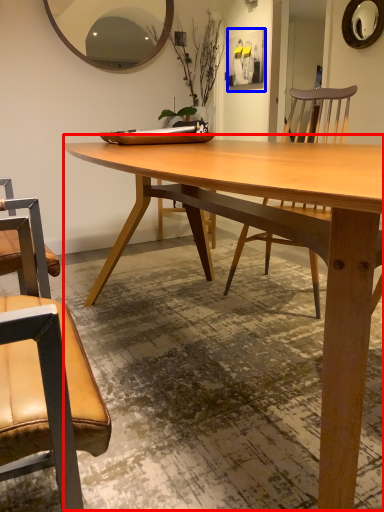
Question: Which of the following is the farthest to the observer, coffee table (highlighted by a red box) or picture frame (highlighted by a blue box)?

Choices:
 (A) coffee table
 (B) picture frame

Answer: (B)